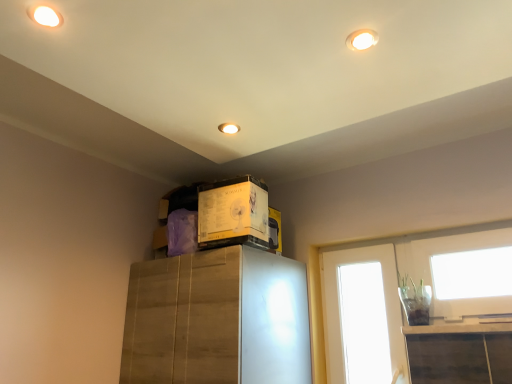
Locate an element on the screen. The height and width of the screenshot is (384, 512). yellow cardboard box at upper center is located at coordinates (233, 213).

What do you see at coordinates (233, 213) in the screenshot? Image resolution: width=512 pixels, height=384 pixels. I see `yellow cardboard box at upper center` at bounding box center [233, 213].

Image resolution: width=512 pixels, height=384 pixels. Describe the element at coordinates (351, 309) in the screenshot. I see `white glossy door at upper right` at that location.

Locate an element on the screen. white glossy door at upper right is located at coordinates (x=351, y=309).

Find the location of a particular element. yellow cardboard box at upper center is located at coordinates (233, 213).

Which object is positioned more to the right, white glossy door at upper right or yellow cardboard box at upper center?

white glossy door at upper right is more to the right.

Does white glossy door at upper right lie behind yellow cardboard box at upper center?

That is True.

Which is in front, point (360, 317) or point (251, 176)?

The point (251, 176) is closer.

From the image's perspective, which object appears higher, white glossy door at upper right or yellow cardboard box at upper center?

yellow cardboard box at upper center.

From a real-world perspective, which is physically above, white glossy door at upper right or yellow cardboard box at upper center?

yellow cardboard box at upper center is physically above.

Which of these two, white glossy door at upper right or yellow cardboard box at upper center, is thinner?

With smaller width is white glossy door at upper right.

Between white glossy door at upper right and yellow cardboard box at upper center, which one has more height?

white glossy door at upper right is taller.

From the picture: Considering the relative sizes of white glossy door at upper right and yellow cardboard box at upper center in the image provided, is white glossy door at upper right bigger than yellow cardboard box at upper center?

Incorrect, white glossy door at upper right is not larger than yellow cardboard box at upper center.

Is white glossy door at upper right inside or outside of yellow cardboard box at upper center?

white glossy door at upper right cannot be found inside yellow cardboard box at upper center.

Would you consider white glossy door at upper right to be distant from yellow cardboard box at upper center?

Actually, white glossy door at upper right and yellow cardboard box at upper center are a little close together.

Is white glossy door at upper right facing towards yellow cardboard box at upper center?

Yes, white glossy door at upper right is aimed at yellow cardboard box at upper center.

Based on the photo, how different are the orientations of white glossy door at upper right and yellow cardboard box at upper center in degrees?

There is a 2.81-degree angle between the facing directions of white glossy door at upper right and yellow cardboard box at upper center.

Measure the distance between white glossy door at upper right and yellow cardboard box at upper center.

The distance of white glossy door at upper right from yellow cardboard box at upper center is 26.57 inches.

The height and width of the screenshot is (384, 512). I want to click on window below the yellow cardboard box at upper center (from the image's perspective), so click(x=351, y=309).

Considering the positions of objects yellow cardboard box at upper center and white glossy door at upper right in the image provided, who is more to the left, yellow cardboard box at upper center or white glossy door at upper right?

From the viewer's perspective, yellow cardboard box at upper center appears more on the left side.

Is the depth of yellow cardboard box at upper center less than that of white glossy door at upper right?

Yes.

Considering the points (209, 232) and (326, 305), which point is in front, point (209, 232) or point (326, 305)?

Point (209, 232)

From the image's perspective, relative to white glossy door at upper right, is yellow cardboard box at upper center above or below?

From the image's perspective, yellow cardboard box at upper center appears above white glossy door at upper right.

From a real-world perspective, is yellow cardboard box at upper center located beneath white glossy door at upper right?

No, from a real-world perspective, yellow cardboard box at upper center is not below white glossy door at upper right.

Considering the relative sizes of yellow cardboard box at upper center and white glossy door at upper right in the image provided, is yellow cardboard box at upper center wider than white glossy door at upper right?

Yes.

In terms of height, does yellow cardboard box at upper center look taller or shorter compared to white glossy door at upper right?

In the image, yellow cardboard box at upper center appears to be shorter than white glossy door at upper right.

Does yellow cardboard box at upper center have a smaller size compared to white glossy door at upper right?

No, yellow cardboard box at upper center is not smaller than white glossy door at upper right.

Could white glossy door at upper right be considered to be inside yellow cardboard box at upper center?

That's incorrect, white glossy door at upper right is not inside yellow cardboard box at upper center.

Is yellow cardboard box at upper center not close to white glossy door at upper right?

yellow cardboard box at upper center is near white glossy door at upper right, not far away.

In the scene shown: Could you tell me if yellow cardboard box at upper center is turned towards white glossy door at upper right?

No, yellow cardboard box at upper center is not turned towards white glossy door at upper right.

What's the angular difference between yellow cardboard box at upper center and white glossy door at upper right's facing directions?

They differ by 2.81 degrees in their facing directions.

Image resolution: width=512 pixels, height=384 pixels. What are the coordinates of `window behind the yellow cardboard box at upper center` in the screenshot? It's located at (351, 309).

Find the location of a particular element. box above the white glossy door at upper right (from a real-world perspective) is located at coordinates (233, 213).

Locate an element on the screen. The width and height of the screenshot is (512, 384). box above the white glossy door at upper right (from the image's perspective) is located at coordinates (233, 213).